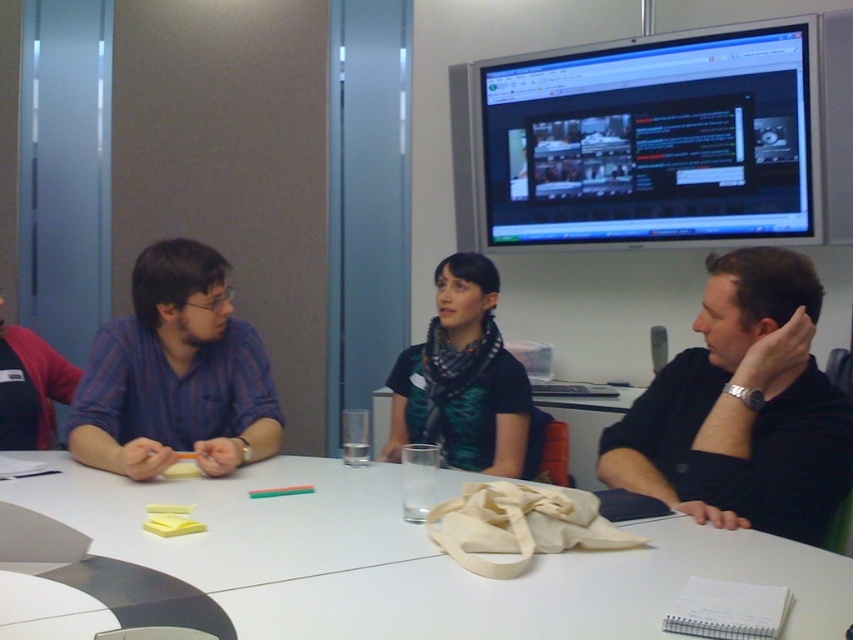
Is black glossy monitor at upper right below black scarf at center?

Actually, black glossy monitor at upper right is above black scarf at center.

Does black glossy monitor at upper right have a lesser width compared to black scarf at center?

No, black glossy monitor at upper right is not thinner than black scarf at center.

Locate an element on the screen. This screenshot has height=640, width=853. black glossy monitor at upper right is located at coordinates (641, 140).

Who is shorter, white matte table at center or black glossy monitor at upper right?

white matte table at center

Is white matte table at center positioned at the back of black glossy monitor at upper right?

No, it is not.

The width and height of the screenshot is (853, 640). I want to click on white matte table at center, so click(412, 561).

Which is above, white matte table at center or black matte shirt at right?

black matte shirt at right is above.

Who is taller, white matte table at center or black matte shirt at right?

With more height is black matte shirt at right.

From the picture: Who is more forward, [851,609] or [776,506]?

Point [851,609] is more forward.

In order to click on white matte table at center in this screenshot , I will do `click(412, 561)`.